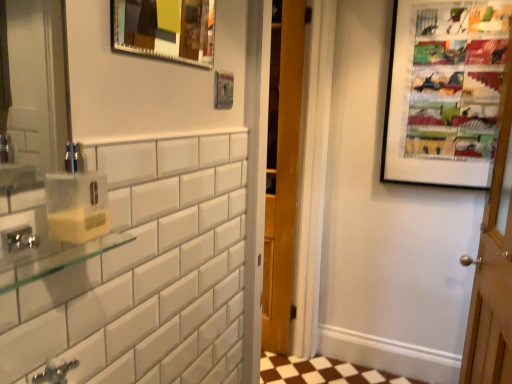
Question: Is yellow translucent soap dispenser at left located outside metallic silver picture frame at upper center, the 3th picture frame in the right-to-left sequence?

Choices:
 (A) yes
 (B) no

Answer: (A)

Question: Is yellow translucent soap dispenser at left facing towards metallic silver picture frame at upper center, the 3th picture frame positioned from the back?

Choices:
 (A) yes
 (B) no

Answer: (B)

Question: Can you confirm if yellow translucent soap dispenser at left is wider than metallic silver picture frame at upper center, marked as the 1th picture frame in a front-to-back arrangement?

Choices:
 (A) no
 (B) yes

Answer: (B)

Question: Is metallic silver picture frame at upper center, the 3th picture frame in the right-to-left sequence, at the back of yellow translucent soap dispenser at left?

Choices:
 (A) no
 (B) yes

Answer: (A)

Question: From the image's perspective, is yellow translucent soap dispenser at left beneath metallic silver picture frame at upper center, the 3th picture frame in the right-to-left sequence?

Choices:
 (A) no
 (B) yes

Answer: (B)

Question: From the image's perspective, is metallic silver picture frame at upper center, acting as the 2th picture frame starting from the right, positioned above or below metallic silver picture frame at upper center, the 3th picture frame in the right-to-left sequence?

Choices:
 (A) above
 (B) below

Answer: (B)

Question: Is metallic silver picture frame at upper center, the 2th picture frame positioned from the back, bigger or smaller than metallic silver picture frame at upper center, the 3th picture frame in the right-to-left sequence?

Choices:
 (A) big
 (B) small

Answer: (B)

Question: Visually, is metallic silver picture frame at upper center, acting as the 2th picture frame starting from the right, positioned to the left or to the right of metallic silver picture frame at upper center, acting as the first picture frame starting from the left?

Choices:
 (A) right
 (B) left

Answer: (A)

Question: Is metallic silver picture frame at upper center, acting as the 2th picture frame starting from the right, in front of or behind metallic silver picture frame at upper center, marked as the 1th picture frame in a front-to-back arrangement, in the image?

Choices:
 (A) behind
 (B) front

Answer: (A)

Question: In terms of height, does metallic silver picture frame at upper center, the 2th picture frame positioned from the back, look taller or shorter compared to clear glass shelf at left?

Choices:
 (A) tall
 (B) short

Answer: (A)

Question: From the image's perspective, is metallic silver picture frame at upper center, the 2th picture frame when ordered from front to back, positioned above or below clear glass shelf at left?

Choices:
 (A) above
 (B) below

Answer: (A)

Question: Looking at their shapes, would you say metallic silver picture frame at upper center, the 2th picture frame in the left-to-right sequence, is wider or thinner than clear glass shelf at left?

Choices:
 (A) wide
 (B) thin

Answer: (B)

Question: Considering the positions of point (219, 77) and point (23, 283), is point (219, 77) closer or farther from the camera than point (23, 283)?

Choices:
 (A) farther
 (B) closer

Answer: (A)

Question: From the image's perspective, is clear glass shelf at left located above or below yellow translucent soap dispenser at left?

Choices:
 (A) below
 (B) above

Answer: (A)

Question: Is point (120, 243) positioned closer to the camera than point (55, 203)?

Choices:
 (A) closer
 (B) farther

Answer: (B)